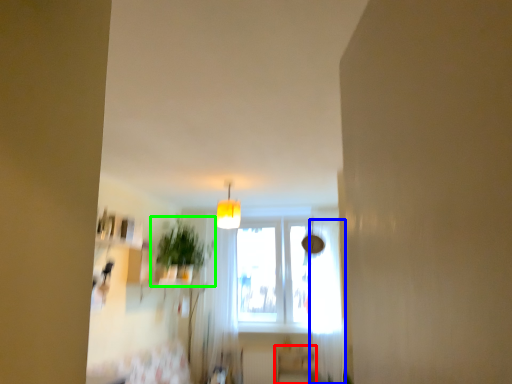
Question: Which is farther away from furniture (highlighted by a red box)? curtain (highlighted by a blue box) or houseplant (highlighted by a green box)?

Choices:
 (A) curtain
 (B) houseplant

Answer: (B)